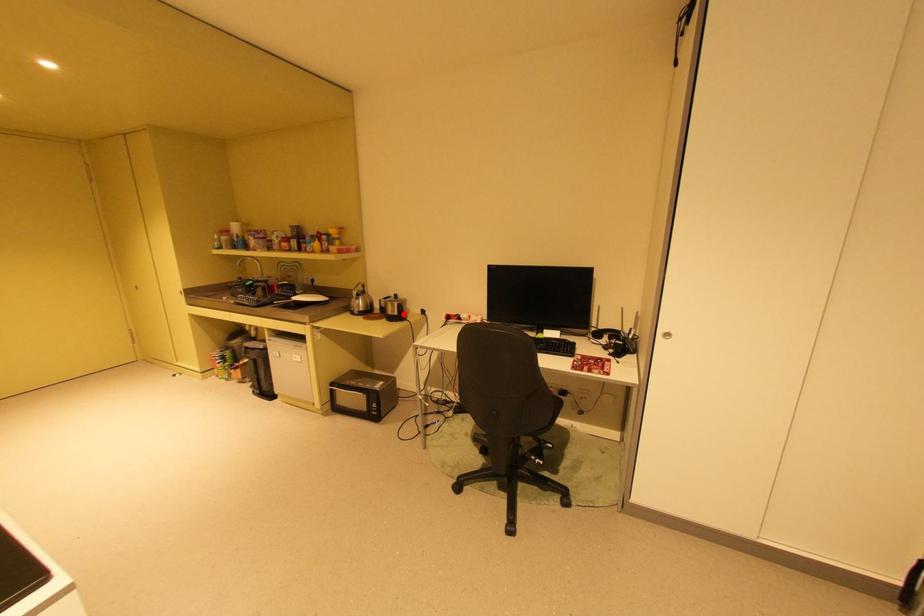
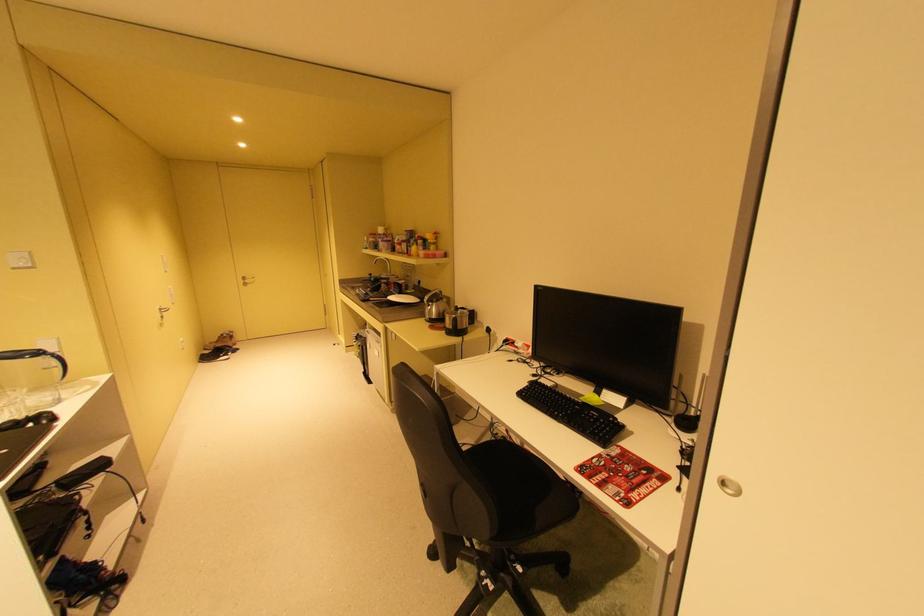
Question: I am providing you with two images of the same scene from different viewpoints. A red point is shown in image1. For the corresponding object point in image2, is it positioned nearer or farther from the camera?

Choices:
 (A) Nearer
 (B) Farther

Answer: (B)